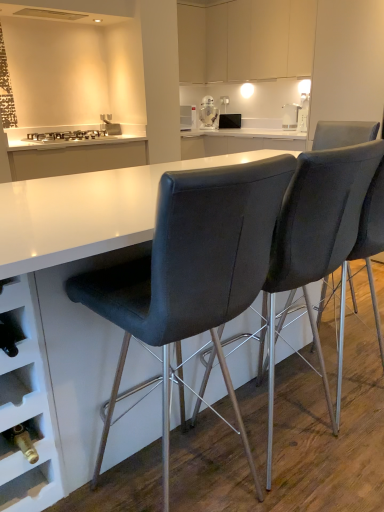
Question: Considering the relative sizes of matte white cabinets at upper center and white glossy stove at upper left in the image provided, is matte white cabinets at upper center thinner than white glossy stove at upper left?

Choices:
 (A) yes
 (B) no

Answer: (A)

Question: Is matte white cabinets at upper center at the right side of white glossy stove at upper left?

Choices:
 (A) yes
 (B) no

Answer: (A)

Question: From the image's perspective, is matte white cabinets at upper center below white glossy stove at upper left?

Choices:
 (A) yes
 (B) no

Answer: (B)

Question: Does matte white cabinets at upper center come behind white glossy stove at upper left?

Choices:
 (A) no
 (B) yes

Answer: (B)

Question: Considering the relative sizes of matte white cabinets at upper center and white glossy stove at upper left in the image provided, is matte white cabinets at upper center smaller than white glossy stove at upper left?

Choices:
 (A) yes
 (B) no

Answer: (B)

Question: Is matte white cabinets at upper center at the left side of white glossy stove at upper left?

Choices:
 (A) yes
 (B) no

Answer: (B)

Question: Is white glossy r2-d2 droid at upper center, which is the second appliance from right to left, bigger than white glossy toaster at upper right?

Choices:
 (A) no
 (B) yes

Answer: (B)

Question: Would you consider white glossy r2-d2 droid at upper center, which ranks as the 1th appliance in left-to-right order, to be distant from white glossy toaster at upper right?

Choices:
 (A) no
 (B) yes

Answer: (A)

Question: From the image's perspective, does white glossy r2-d2 droid at upper center, which ranks as the 1th appliance in left-to-right order, appear higher than white glossy toaster at upper right?

Choices:
 (A) yes
 (B) no

Answer: (A)

Question: Considering the relative sizes of white glossy r2-d2 droid at upper center, which ranks as the 1th appliance in left-to-right order, and white glossy toaster at upper right in the image provided, is white glossy r2-d2 droid at upper center, which ranks as the 1th appliance in left-to-right order, wider than white glossy toaster at upper right?

Choices:
 (A) no
 (B) yes

Answer: (B)

Question: Is white glossy r2-d2 droid at upper center, which is the second appliance from right to left, positioned with its back to white glossy toaster at upper right?

Choices:
 (A) no
 (B) yes

Answer: (A)

Question: Is white glossy r2-d2 droid at upper center, which is the second appliance from right to left, not within white glossy toaster at upper right?

Choices:
 (A) no
 (B) yes

Answer: (B)

Question: Would you say white glossy stove at upper left contains matte black microwave at center, the first appliance when ordered from right to left?

Choices:
 (A) no
 (B) yes

Answer: (A)